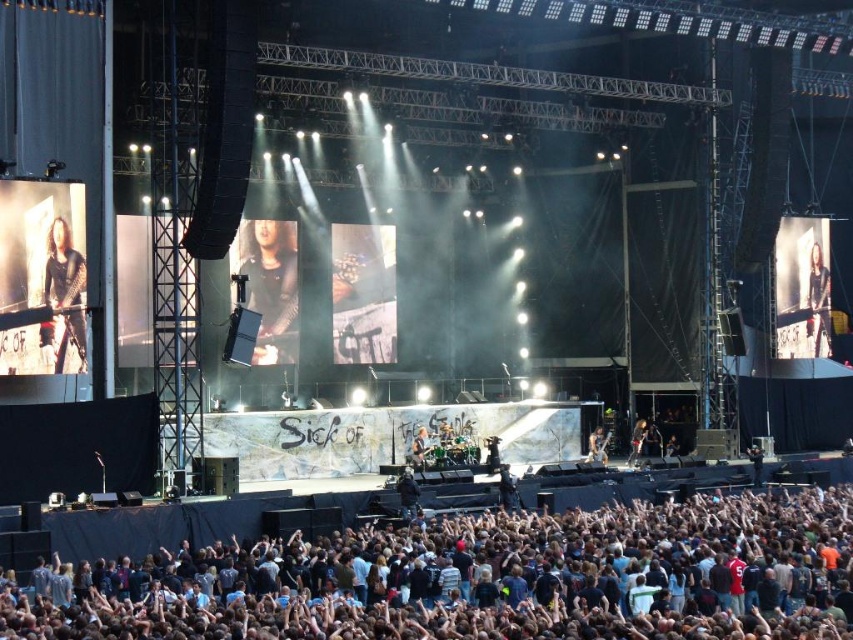
Question: Which of the following is the closest to the observer?

Choices:
 (A) shiny black guitar at center
 (B) metallic silver guitar at center
 (C) dark gray crowd at lower center
 (D) matte black guitar at center

Answer: (C)

Question: Does dark brown leather jacket at left appear over shiny silver guitar at center?

Choices:
 (A) no
 (B) yes

Answer: (B)

Question: Is matte black guitar at center above shiny black guitar at center?

Choices:
 (A) no
 (B) yes

Answer: (B)

Question: Can you confirm if dark gray crowd at lower center is thinner than metallic silver guitar at center?

Choices:
 (A) yes
 (B) no

Answer: (B)

Question: Which object appears closest to the camera in this image?

Choices:
 (A) shiny silver guitar at center
 (B) dark brown leather jacket at left
 (C) dark gray crowd at lower center
 (D) shiny black guitar at center

Answer: (C)

Question: Which object is farther from the camera taking this photo?

Choices:
 (A) matte black guitar at center
 (B) black leather jacket at right
 (C) dark gray crowd at lower center

Answer: (B)